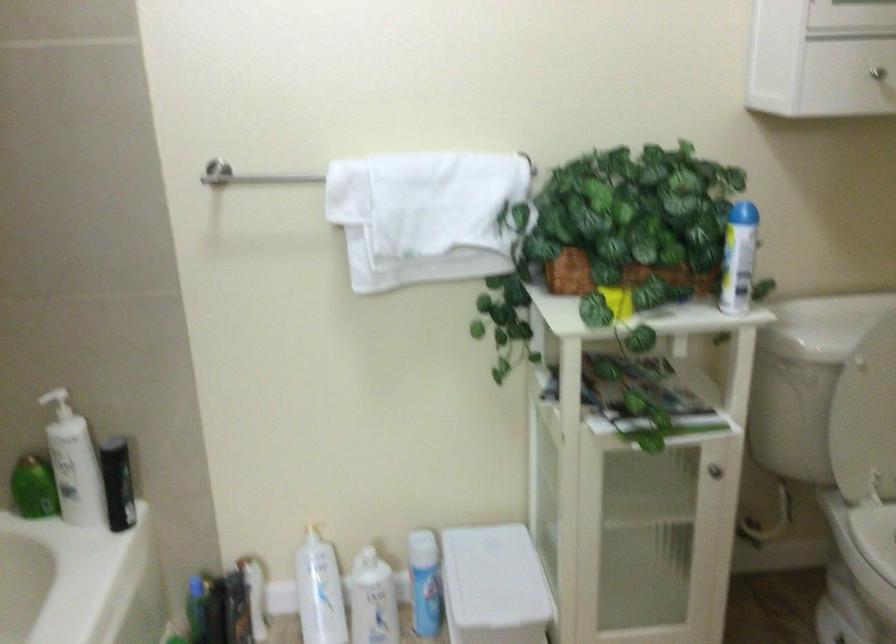
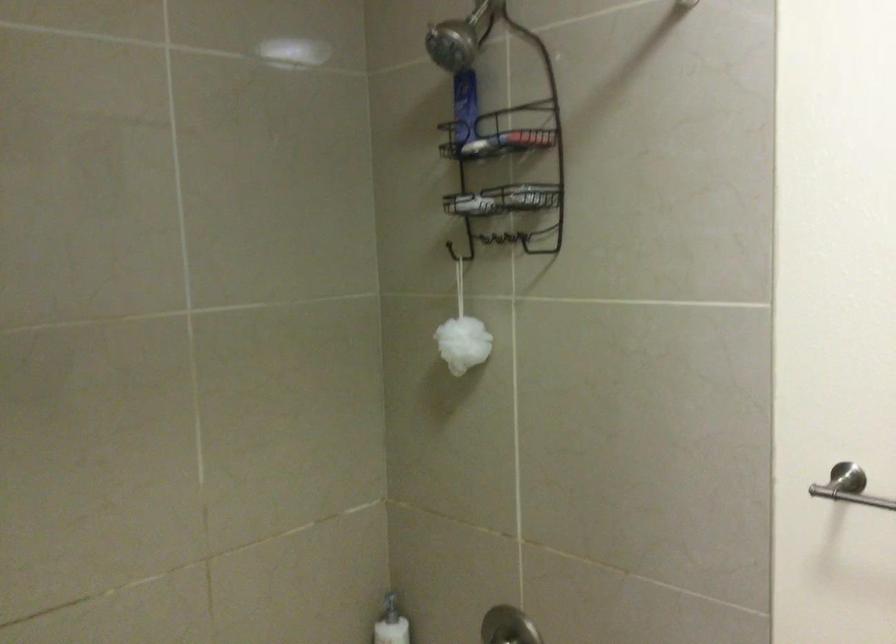
Question: The camera is either moving clockwise (left) or counter-clockwise (right) around the object. The first image is from the beginning of the video and the second image is from the end. Is the camera moving left or right when shooting the video?

Choices:
 (A) Left
 (B) Right

Answer: (B)